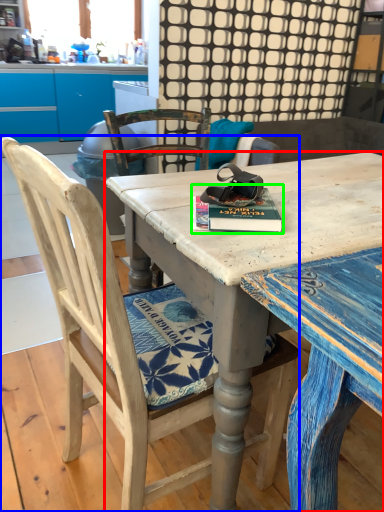
Question: Which object is the farthest from desk (highlighted by a red box)? Choose among these: chair (highlighted by a blue box) or paperback book (highlighted by a green box).

Choices:
 (A) chair
 (B) paperback book

Answer: (A)